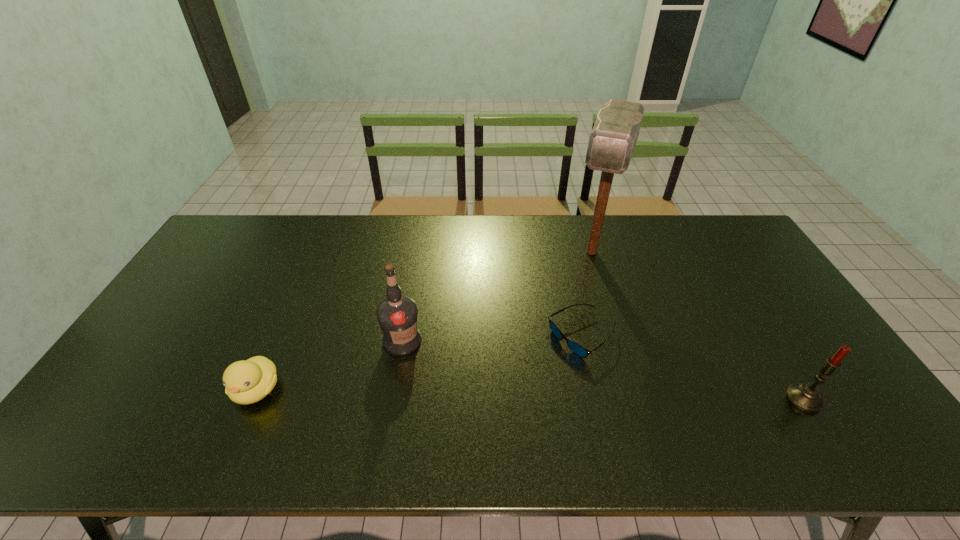
Find the location of a particular element. Image resolution: width=960 pixels, height=540 pixels. duckling positioned at the near edge is located at coordinates (248, 381).

The width and height of the screenshot is (960, 540). What are the coordinates of `candle at the near edge` in the screenshot? It's located at (807, 397).

Locate an element on the screen. Image resolution: width=960 pixels, height=540 pixels. object present at the right edge is located at coordinates (807, 397).

This screenshot has width=960, height=540. Find the location of `object situated at the near right corner`. object situated at the near right corner is located at coordinates (807, 397).

Image resolution: width=960 pixels, height=540 pixels. Identify the location of vacant space at the far edge of the desktop. pyautogui.click(x=543, y=219).

The image size is (960, 540). I want to click on free spot at the near edge of the desktop, so click(629, 409).

Locate an element on the screen. The height and width of the screenshot is (540, 960). vacant space at the left edge of the desktop is located at coordinates (230, 261).

You are a GUI agent. You are given a task and a screenshot of the screen. Output one action in this format:
    pyautogui.click(x=<x>, y=<y>)
    Task: Click on the blank space at the right edge of the desktop
    
    Given the screenshot: What is the action you would take?
    pyautogui.click(x=794, y=340)

This screenshot has width=960, height=540. Find the location of `vacant region between the third shortest object and the second shortest object`. vacant region between the third shortest object and the second shortest object is located at coordinates (530, 394).

The width and height of the screenshot is (960, 540). In order to click on free spot between the tallest object and the sunglasses in this screenshot , I will do `click(587, 294)`.